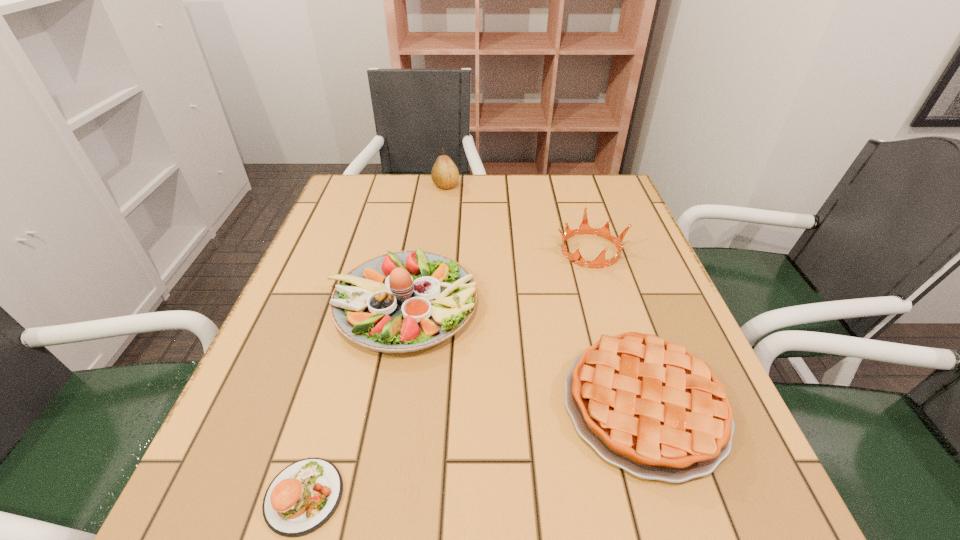
Image resolution: width=960 pixels, height=540 pixels. What are the coordinates of `object situated at the far edge` in the screenshot? It's located at pyautogui.click(x=444, y=174).

Identify the location of pie that is at the near edge. The width and height of the screenshot is (960, 540). (646, 405).

Identify the location of patty at the near edge. (303, 496).

This screenshot has width=960, height=540. What are the coordinates of `salad plate that is positioned at the left edge` in the screenshot? It's located at (405, 301).

Where is `patty positioned at the left edge`? patty positioned at the left edge is located at coordinates (303, 496).

Locate an element on the screen. crown that is at the right edge is located at coordinates (600, 262).

Locate an element on the screen. Image resolution: width=960 pixels, height=540 pixels. pie situated at the right edge is located at coordinates (646, 405).

You are a GUI agent. You are given a task and a screenshot of the screen. Output one action in this format:
    pyautogui.click(x=<x>, y=<y>)
    Task: Click on the object that is at the near left corner
    The image size is (960, 540).
    Given the screenshot: What is the action you would take?
    pyautogui.click(x=303, y=496)

Locate an element on the screen. This screenshot has width=960, height=540. object located in the near right corner section of the desktop is located at coordinates (646, 405).

The width and height of the screenshot is (960, 540). In order to click on vacant space at the far edge of the desktop in this screenshot , I will do 445,212.